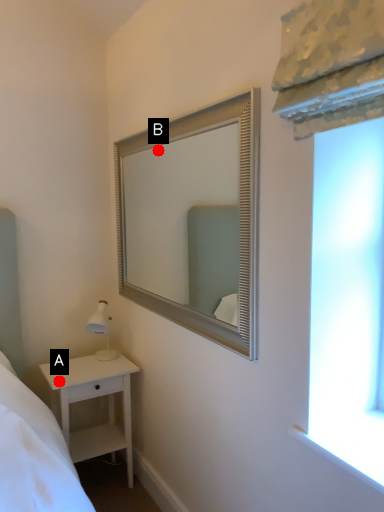
Question: Two points are circled on the image, labeled by A and B beside each circle. Which point is closer to the camera?

Choices:
 (A) A is closer
 (B) B is closer

Answer: (A)